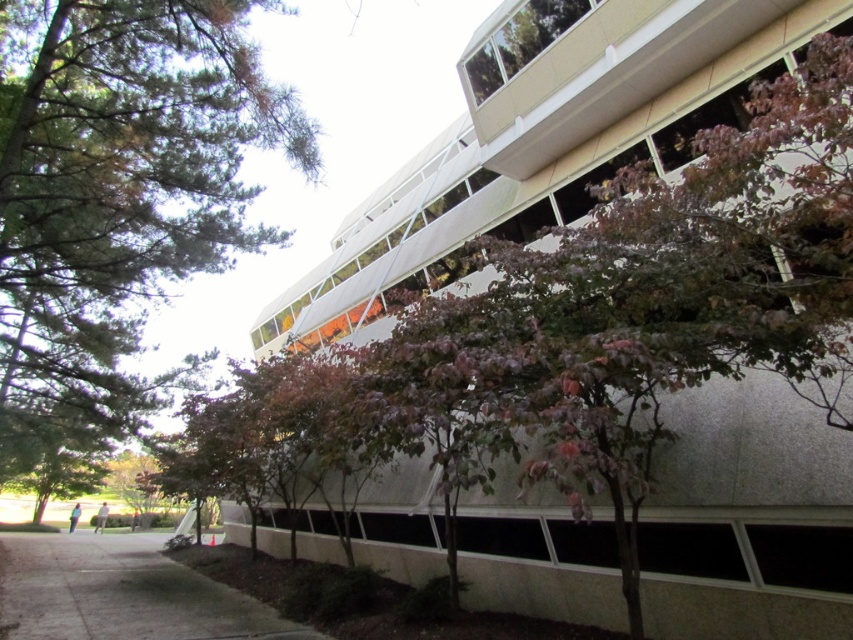
Question: Can you confirm if green leafy tree at upper left is positioned to the left of gray concrete pavement at lower left?

Choices:
 (A) no
 (B) yes

Answer: (B)

Question: Is green leafy tree at upper left thinner than gray concrete pavement at lower left?

Choices:
 (A) yes
 (B) no

Answer: (B)

Question: Which of the following is the closest to the observer?

Choices:
 (A) green leafy tree at upper left
 (B) gray concrete pavement at lower left

Answer: (A)

Question: Is green leafy tree at upper left smaller than gray concrete pavement at lower left?

Choices:
 (A) no
 (B) yes

Answer: (A)

Question: Among these points, which one is farthest from the camera?

Choices:
 (A) (38, 394)
 (B) (132, 544)

Answer: (B)

Question: Which of the following is the closest to the observer?

Choices:
 (A) green leafy tree at upper left
 (B) gray concrete pavement at lower left

Answer: (A)